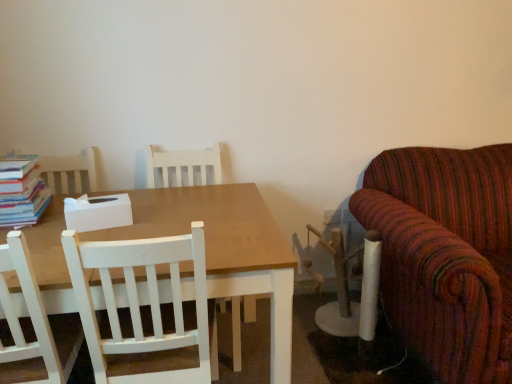
Where is `free spot to the right of hardcover books at left`? free spot to the right of hardcover books at left is located at coordinates (53, 217).